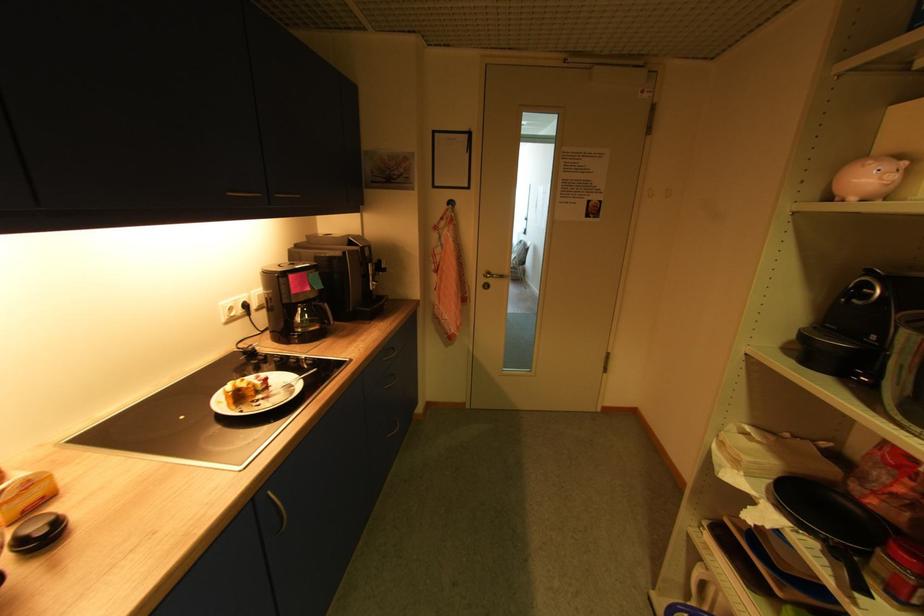
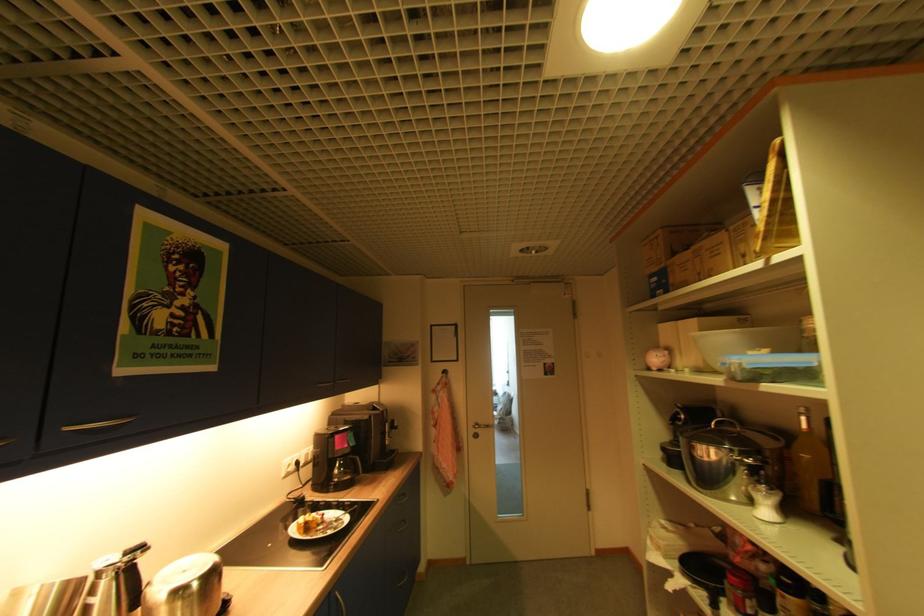
Question: Which direction would the cameraman need to move to produce the second image? Reply with the corresponding letter.

Choices:
 (A) Left
 (B) Right
 (C) Forward
 (D) Backward

Answer: (D)